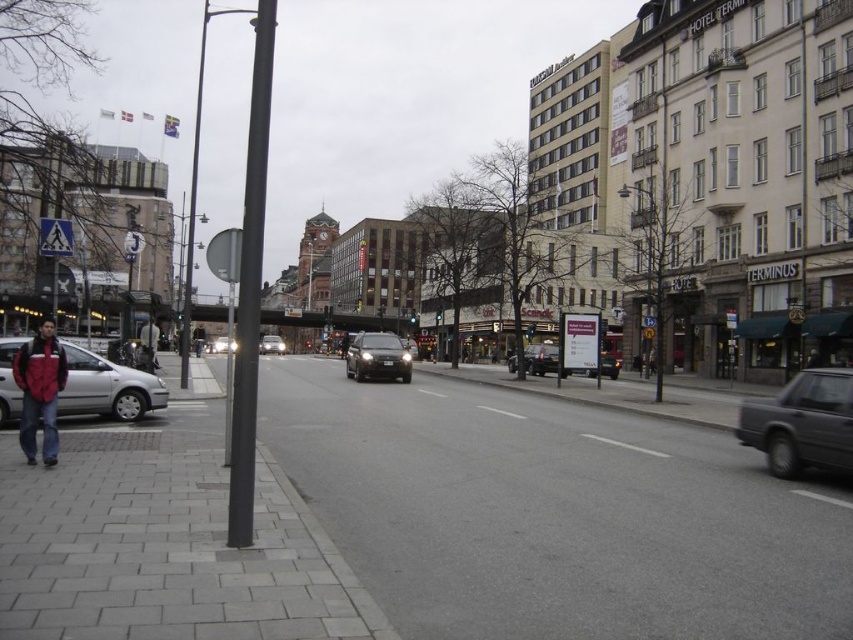
Between silver metallic car at lower left and shiny silver sedan at center, which one has less height?

silver metallic car at lower left is shorter.

The image size is (853, 640). Describe the element at coordinates (107, 387) in the screenshot. I see `silver metallic car at lower left` at that location.

Where is `silver metallic car at lower left`? This screenshot has height=640, width=853. silver metallic car at lower left is located at coordinates (107, 387).

Can you confirm if metallic pole at left is smaller than silver metallic sedan at center?

Indeed, metallic pole at left has a smaller size compared to silver metallic sedan at center.

What do you see at coordinates (250, 285) in the screenshot? I see `metallic pole at left` at bounding box center [250, 285].

This screenshot has height=640, width=853. Identify the location of metallic pole at left. (250, 285).

Which of these two, gray concrete pavement at lower left or red jacket at lower left, stands shorter?

Standing shorter between the two is gray concrete pavement at lower left.

I want to click on gray concrete pavement at lower left, so click(x=554, y=515).

This screenshot has height=640, width=853. What are the coordinates of `gray concrete pavement at lower left` in the screenshot? It's located at coord(554,515).